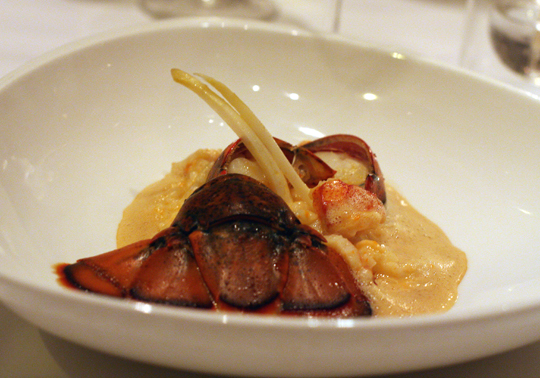
Where is `background white tablecloth area`? The height and width of the screenshot is (378, 540). background white tablecloth area is located at coordinates (40, 28), (411, 26).